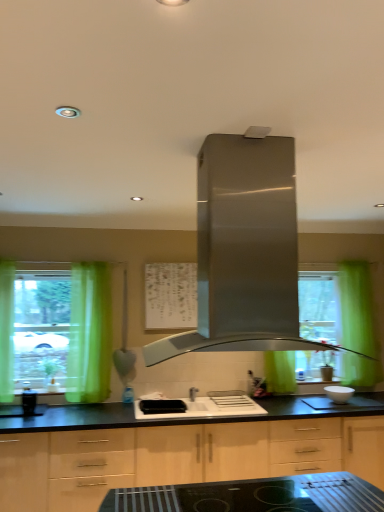
Question: Does white glossy sink at center have a greater width compared to black glossy coffee maker at left?

Choices:
 (A) yes
 (B) no

Answer: (A)

Question: From a real-world perspective, is white glossy sink at center on top of black glossy coffee maker at left?

Choices:
 (A) yes
 (B) no

Answer: (B)

Question: Does white glossy sink at center appear on the right side of black glossy coffee maker at left?

Choices:
 (A) no
 (B) yes

Answer: (B)

Question: Considering the relative sizes of white glossy sink at center and black glossy coffee maker at left in the image provided, is white glossy sink at center bigger than black glossy coffee maker at left?

Choices:
 (A) yes
 (B) no

Answer: (A)

Question: From a real-world perspective, is white glossy sink at center below black glossy coffee maker at left?

Choices:
 (A) no
 (B) yes

Answer: (B)

Question: Can you confirm if white glossy sink at center is smaller than black glossy coffee maker at left?

Choices:
 (A) no
 (B) yes

Answer: (A)

Question: Is transparent glass window at left behind black glossy coffee maker at left?

Choices:
 (A) no
 (B) yes

Answer: (B)

Question: Does transparent glass window at left have a greater height compared to black glossy coffee maker at left?

Choices:
 (A) no
 (B) yes

Answer: (B)

Question: Can you confirm if transparent glass window at left is bigger than black glossy coffee maker at left?

Choices:
 (A) yes
 (B) no

Answer: (A)

Question: From a real-world perspective, is transparent glass window at left physically above black glossy coffee maker at left?

Choices:
 (A) yes
 (B) no

Answer: (A)

Question: From the image's perspective, is transparent glass window at left on top of black glossy coffee maker at left?

Choices:
 (A) yes
 (B) no

Answer: (A)

Question: Can you see transparent glass window at left touching black glossy coffee maker at left?

Choices:
 (A) no
 (B) yes

Answer: (A)

Question: Could you tell me if light wood cabinet at center is turned towards green fabric curtain at left?

Choices:
 (A) no
 (B) yes

Answer: (A)